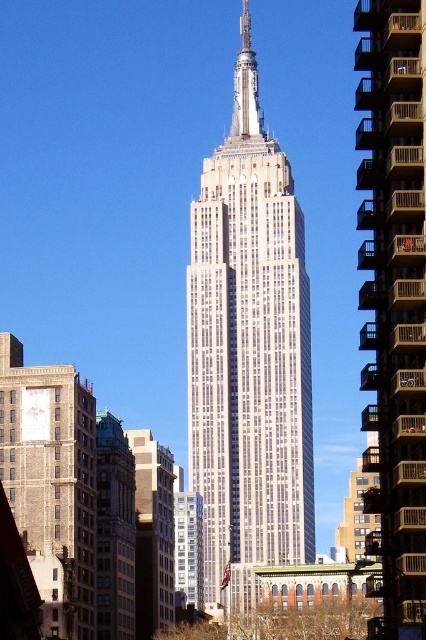
You are standing in the middle of the street looking at the Empire State Building. You notice two buildings in the scene, the white stone building at center and the gray stone building at center. Which one is positioned to the right side of the other?

The white stone building at center is to the right of the gray stone building at center according to the description.

You are standing at the Empire State Building and want to locate the brown concrete building at right. According to the coordinates provided, where should you look relative to your current position?

The brown concrete building at right is located at coordinates point (394, 298), which means it is positioned to the right and slightly above your current viewpoint.

You are standing in front of the Empire State Building and want to reach a specific point marked at coordinates point (377, 116). Given that the distance to this point is 82.46 meters, can you estimate whether this point is closer to the base or the top of the Empire State Building?

The point (377, 116) is located 82.46 meters away from the viewer. Since the Empire State Building is a tall skyscraper, the base would generally be closer to the viewer than the top. Therefore, the point is closer to the base of the Empire State Building.